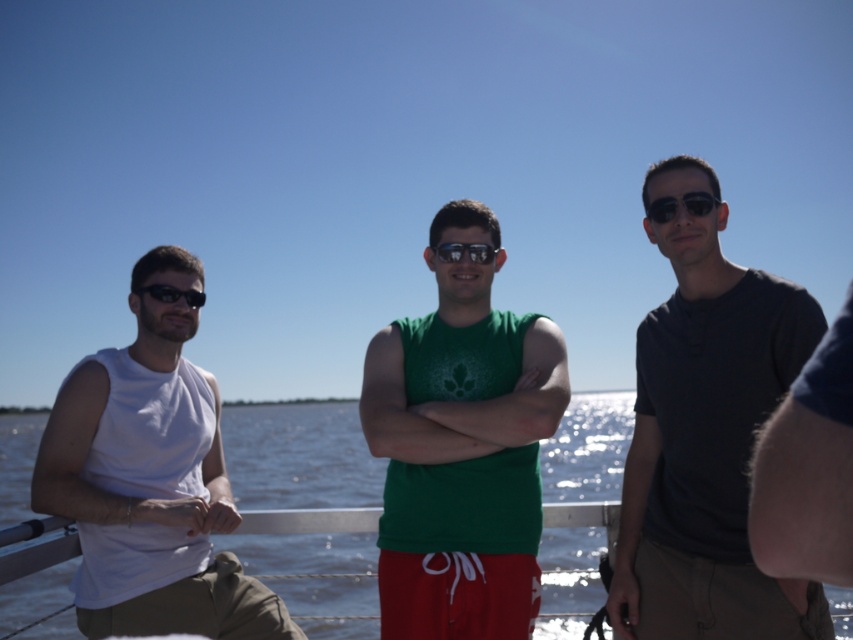
You are a photographer trying to capture a closeup of the black reflective sunglasses at center and the matte black goggles at center. Which object should you focus on first if you want to ensure both are in focus without moving the camera?

The black reflective sunglasses at center is located above matte black goggles at center, so you should focus on the matte black goggles at center first since it is closer to the camera. This way, the depth of field will cover both objects when focusing on the closer one.

You are a photographer trying to capture a group photo of the three people in the scene. You want to ensure that the green matte tank top at center is clearly visible in the photo. Based on its position, where should you position the camera relative to the group?

To ensure the green matte tank top at center is clearly visible, position the camera so that it faces directly toward the center of the group, as the green matte tank top at center is located at point (461, 449), which is near the central area of the scene.

From the picture: You are a photographer trying to capture a closeup shot of both the black reflective sunglasses at center and the matte black goggles at center. Given that your camera lens has a maximum focus range of 90 centimeters, will you be able to fit both items within the frame without moving closer?

The black reflective sunglasses at center and matte black goggles at center are 89.42 centimeters apart from each other. Since the distance between them is less than the camera lens maximum focus range of 90 centimeters, you can fit both items within the frame without moving closer.